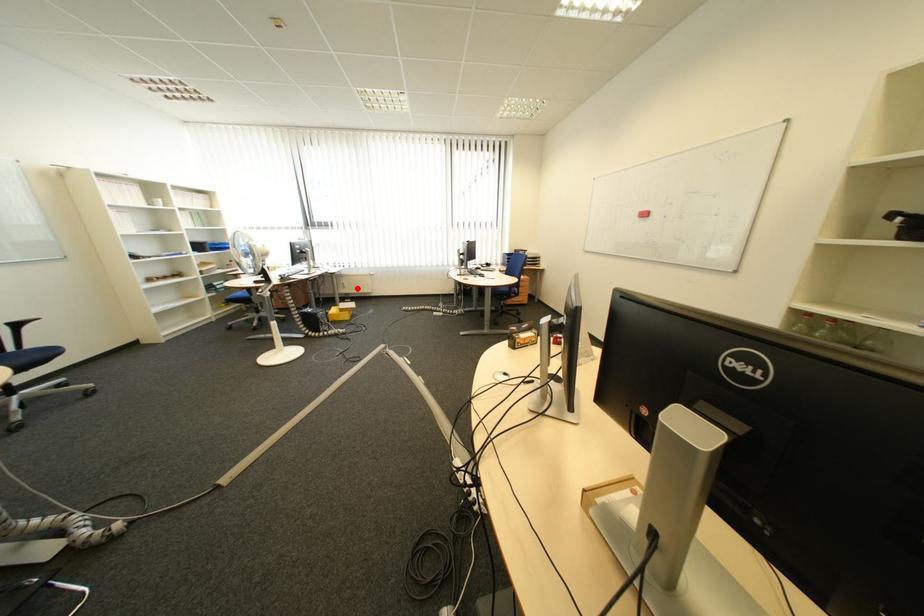
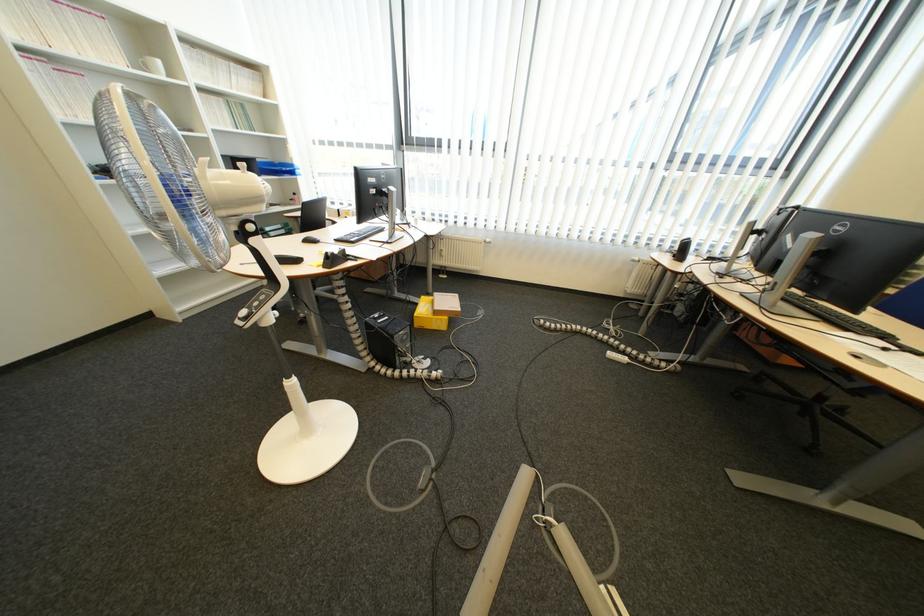
The point at the highlighted location is marked in the first image. Where is the corresponding point in the second image?

(455, 257)